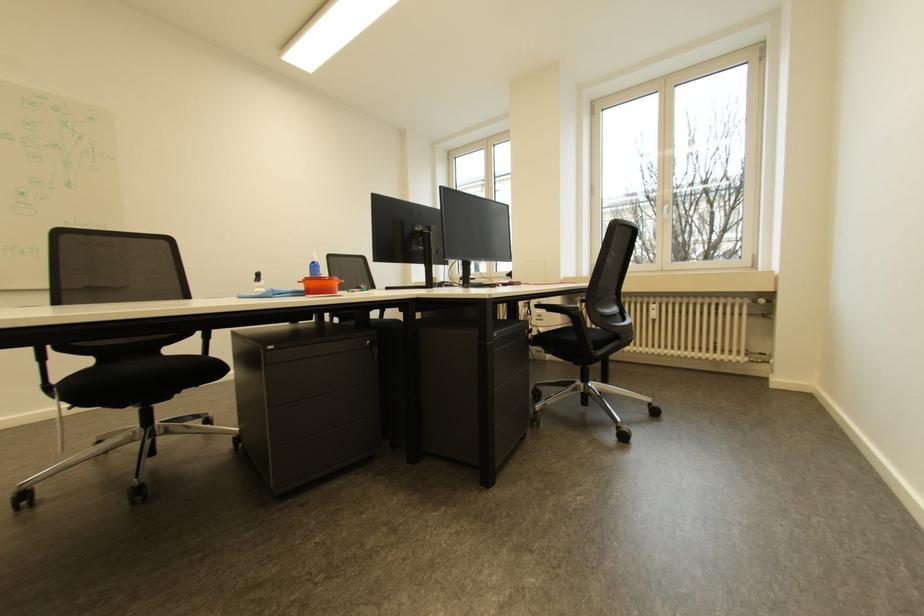
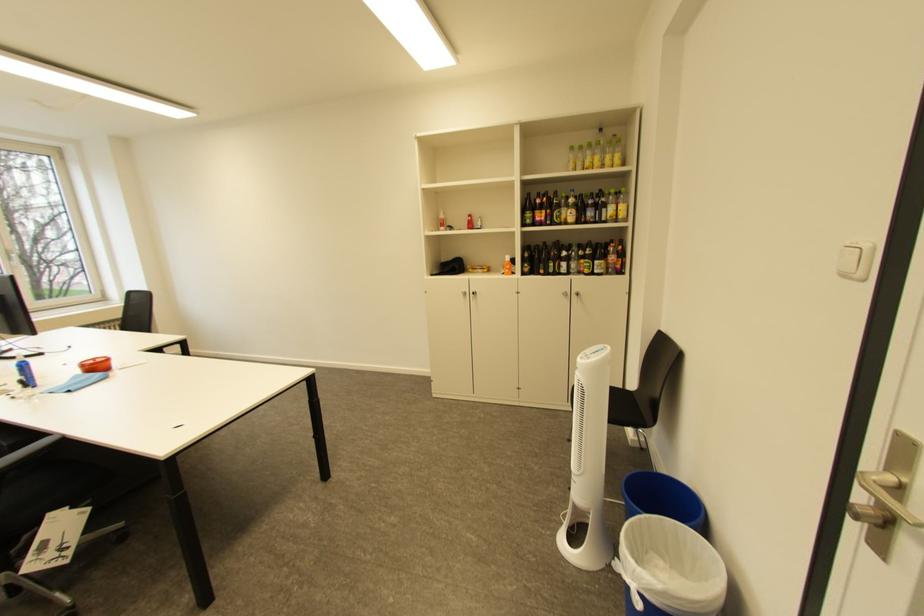
Question: I am providing you with two images of the same scene from different viewpoints. After the viewpoint changes to image2, which objects are now occluded?

Choices:
 (A) white trash can
 (B) blue trash can
 (C) red push button
 (D) drawer handle

Answer: (D)